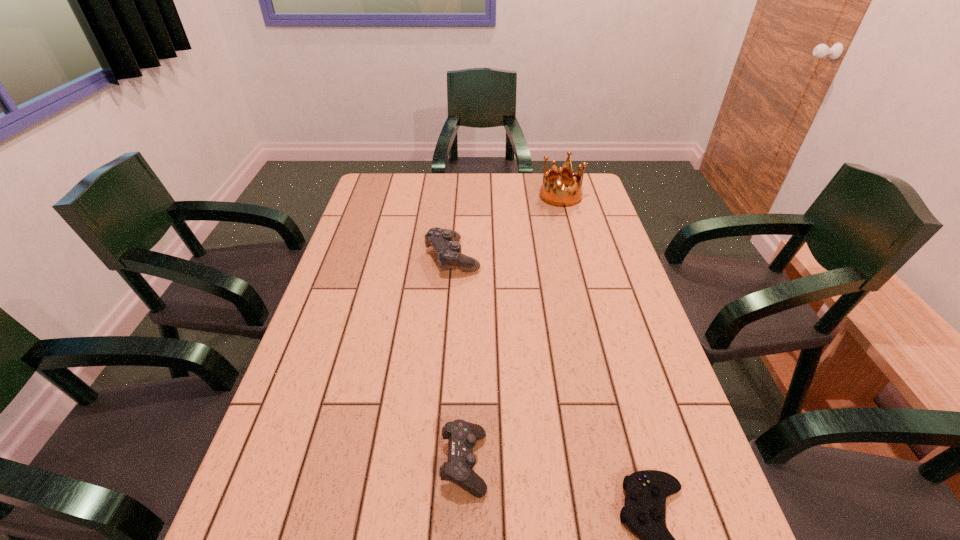
The height and width of the screenshot is (540, 960). Identify the location of free area in between the farthest object and the second tallest control. (513, 329).

At what (x,y) coordinates should I click in order to perform the action: click on free area in between the second shortest control and the farthest control. Please return your answer as a coordinate pair (x, y). Looking at the image, I should click on (458, 360).

Where is `vacant space in between the crown and the farthest control`? The image size is (960, 540). vacant space in between the crown and the farthest control is located at coordinates (507, 227).

Find the location of a particular element. This screenshot has width=960, height=540. the second closest object to the second farthest object is located at coordinates (462, 435).

Identify which object is located as the nearest to the third tallest object. Please provide its 2D coordinates. Your answer should be formatted as a tuple, i.e. [(x, y)], where the tuple contains the x and y coordinates of a point satisfying the conditions above.

[(644, 512)]

The image size is (960, 540). I want to click on control that stands as the second closest to the tallest control, so click(x=644, y=512).

Identify the location of the second closest control to the rightmost control. (444, 242).

Where is `vacant space that satisfies the following two spatial constraints: 1. on the back side of the second tallest control; 2. on the right side of the crown`? Image resolution: width=960 pixels, height=540 pixels. vacant space that satisfies the following two spatial constraints: 1. on the back side of the second tallest control; 2. on the right side of the crown is located at coordinates (471, 196).

What are the coordinates of `vacant position in the image that satisfies the following two spatial constraints: 1. on the back side of the second tallest control; 2. on the left side of the farthest object` in the screenshot? It's located at (471, 196).

You are a GUI agent. You are given a task and a screenshot of the screen. Output one action in this format:
    pyautogui.click(x=<x>, y=<y>)
    Task: Click on the vacant point that satisfies the following two spatial constraints: 1. on the back side of the tallest object; 2. on the left side of the second shortest control
    
    Given the screenshot: What is the action you would take?
    pyautogui.click(x=471, y=196)